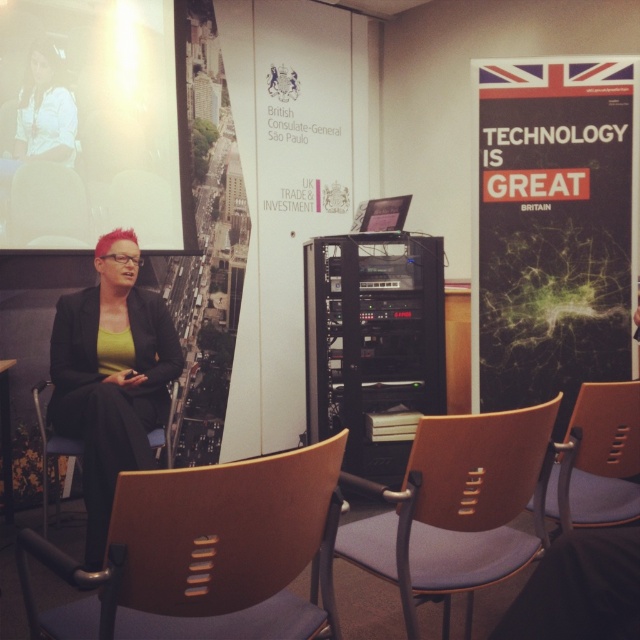
Based on the photo, which is more to the right, matte black chair at center or matte black chair at lower left?

From the viewer's perspective, matte black chair at lower left appears more on the right side.

Which is in front, point (36, 230) or point (163, 448)?

Point (36, 230)

Which is in front, point (56, 184) or point (44, 448)?

Point (44, 448) is in front.

Identify the location of matte black chair at center. Image resolution: width=640 pixels, height=640 pixels. (48, 208).

Between matte black poster at right and matte black jacket at center, which one is positioned lower?

matte black jacket at center is lower down.

The height and width of the screenshot is (640, 640). Find the location of `matte black poster at right`. matte black poster at right is located at coordinates pos(554,228).

Where is `matte black poster at right`? The width and height of the screenshot is (640, 640). matte black poster at right is located at coordinates (554, 228).

Between wooden chair with blue cushion at center and matte black chair at lower left, which one is positioned lower?

matte black chair at lower left is lower down.

Is point (506, 563) more distant than point (45, 452)?

No, it is not.

Is point (531, 474) positioned behind point (72, 451)?

That is False.

At what (x,y) coordinates should I click in order to perform the action: click on wooden chair with blue cushion at center. Please return your answer as a coordinate pair (x, y). This screenshot has height=640, width=640. Looking at the image, I should click on 456,508.